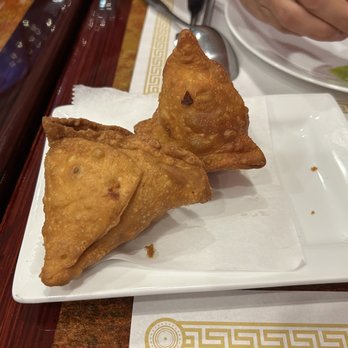
Locate an element on the screen. napkin on plate is located at coordinates (216, 243), (106, 113).